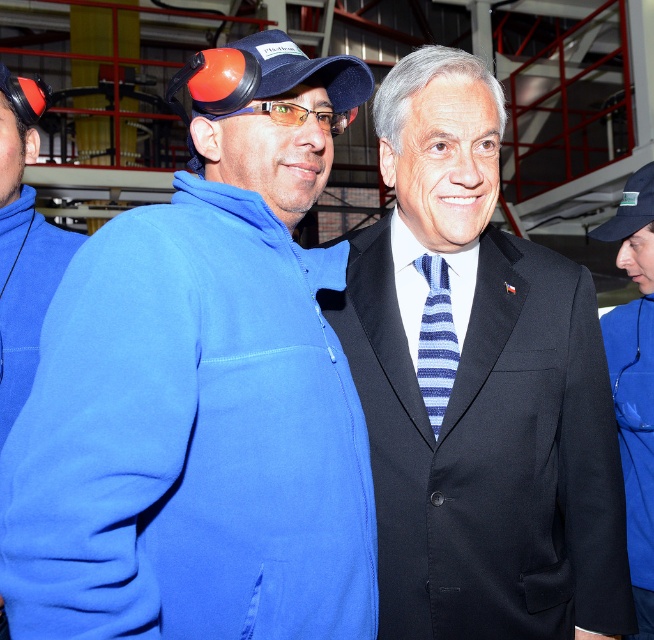
Question: Can you confirm if matte black suit at center is thinner than orange plastic goggles at center?

Choices:
 (A) yes
 (B) no

Answer: (B)

Question: Which point is farther from the camera taking this photo?

Choices:
 (A) (317, 497)
 (B) (632, 301)
 (C) (485, 474)
 (D) (439, 358)

Answer: (B)

Question: Among these objects, which one is farthest from the camera?

Choices:
 (A) blue fleece jacket at center
 (B) matte black suit at center
 (C) blue striped tie at center

Answer: (A)

Question: Can you confirm if blue fleece jacket at center is positioned below orange plastic goggles at center?

Choices:
 (A) no
 (B) yes

Answer: (B)

Question: Does blue fleece jacket at left have a larger size compared to blue fleece jacket at center?

Choices:
 (A) yes
 (B) no

Answer: (A)

Question: Which of these objects is positioned closest to the orange plastic goggles at center?

Choices:
 (A) matte black suit at center
 (B) matte blue baseball cap at center
 (C) blue fleece jacket at center
 (D) blue fleece jacket at left

Answer: (B)